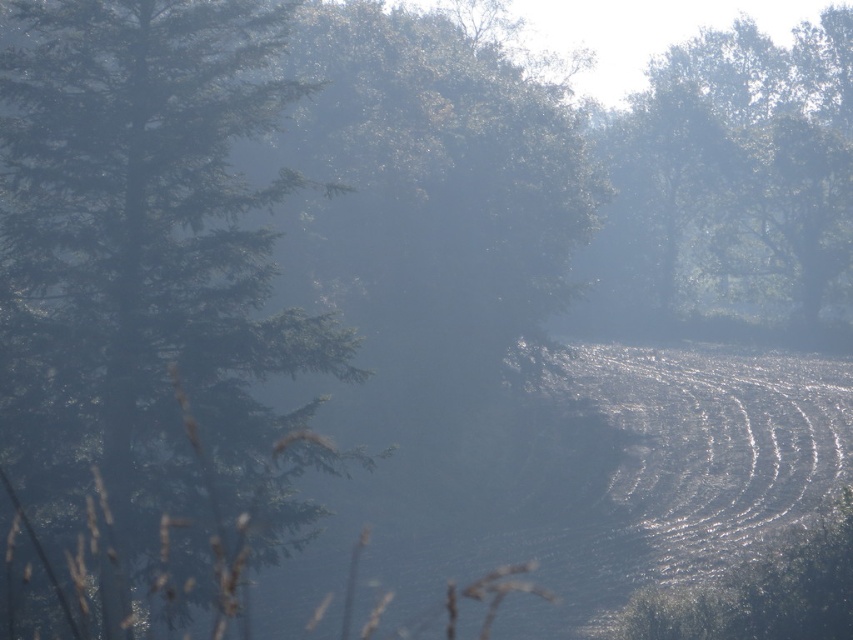
Question: Which object is closer to the camera taking this photo?

Choices:
 (A) green matte tree at left
 (B) green leafy tree at upper right

Answer: (A)

Question: Does green matte tree at left have a larger size compared to green leafy tree at upper right?

Choices:
 (A) no
 (B) yes

Answer: (A)

Question: Which point appears closest to the camera in this image?

Choices:
 (A) (258, 504)
 (B) (724, 184)

Answer: (A)

Question: Is green matte tree at left positioned in front of green leafy tree at upper right?

Choices:
 (A) yes
 (B) no

Answer: (A)

Question: Is green matte tree at left to the left of green leafy tree at upper right from the viewer's perspective?

Choices:
 (A) yes
 (B) no

Answer: (A)

Question: Which point is closer to the camera?

Choices:
 (A) (819, 90)
 (B) (62, 307)

Answer: (B)